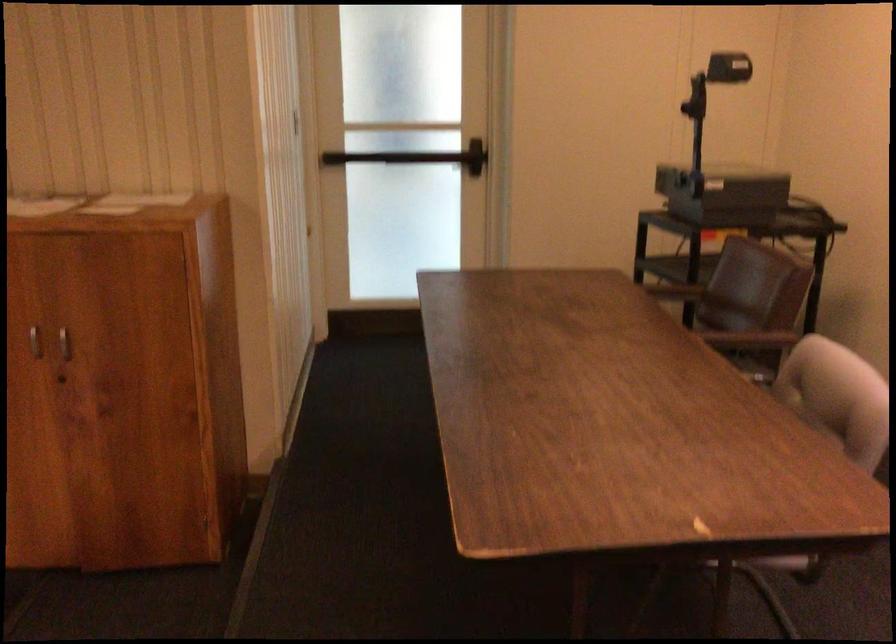
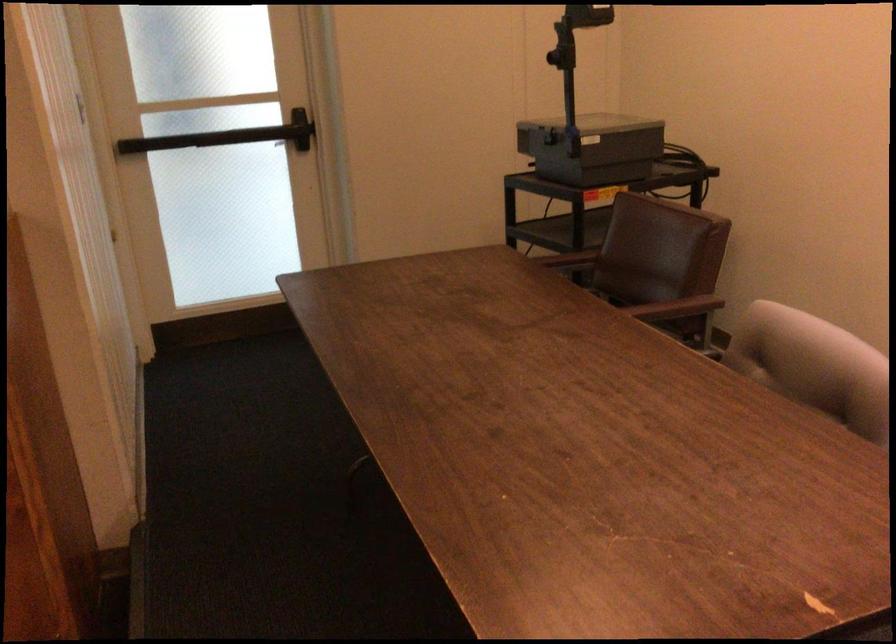
Locate, in the second image, the point that corresponds to (394,156) in the first image.

(207, 138)